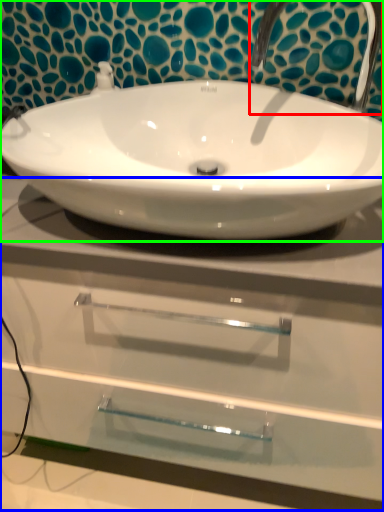
Question: Which is farther away from plumbing fixture (highlighted by a red box)? counter top (highlighted by a blue box) or sink (highlighted by a green box)?

Choices:
 (A) counter top
 (B) sink

Answer: (A)